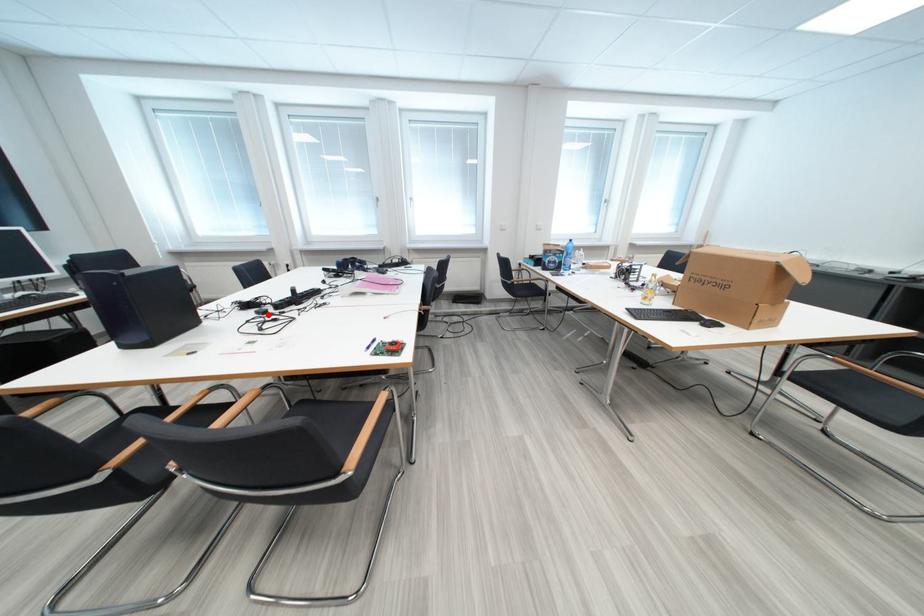
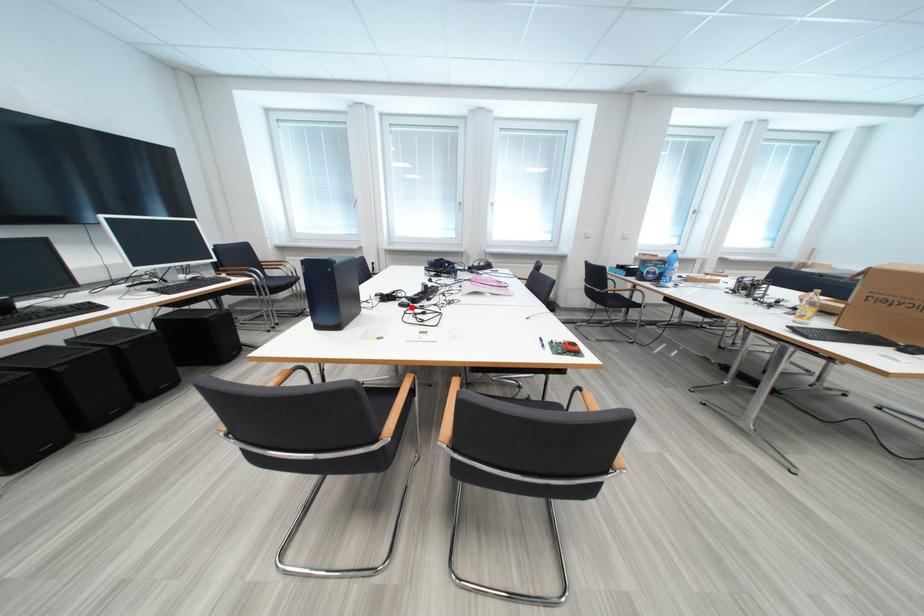
I am providing you with two images of the same scene from different viewpoints. A red point is marked on the first image and another point is marked on the second image. Does the point marked in image1 correspond to the same location as the one in image2?

Yes